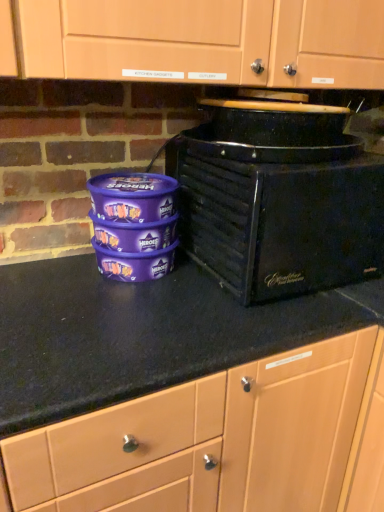
What do you see at coordinates (278, 209) in the screenshot? I see `black plastic microwave at right` at bounding box center [278, 209].

Where is `black plastic microwave at right`? This screenshot has width=384, height=512. black plastic microwave at right is located at coordinates (278, 209).

Where is `black plastic microwave at right`? This screenshot has height=512, width=384. black plastic microwave at right is located at coordinates (278, 209).